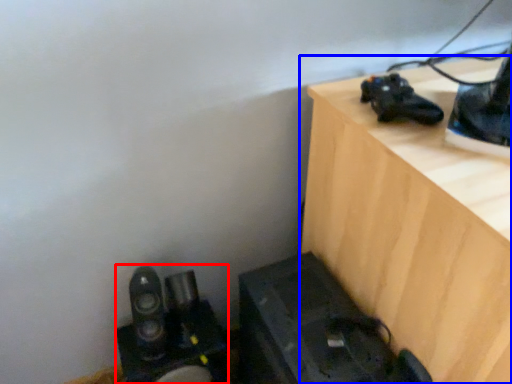
Question: Which point is further to the camera, equipment (highlighted by a red box) or furniture (highlighted by a blue box)?

Choices:
 (A) equipment
 (B) furniture

Answer: (A)